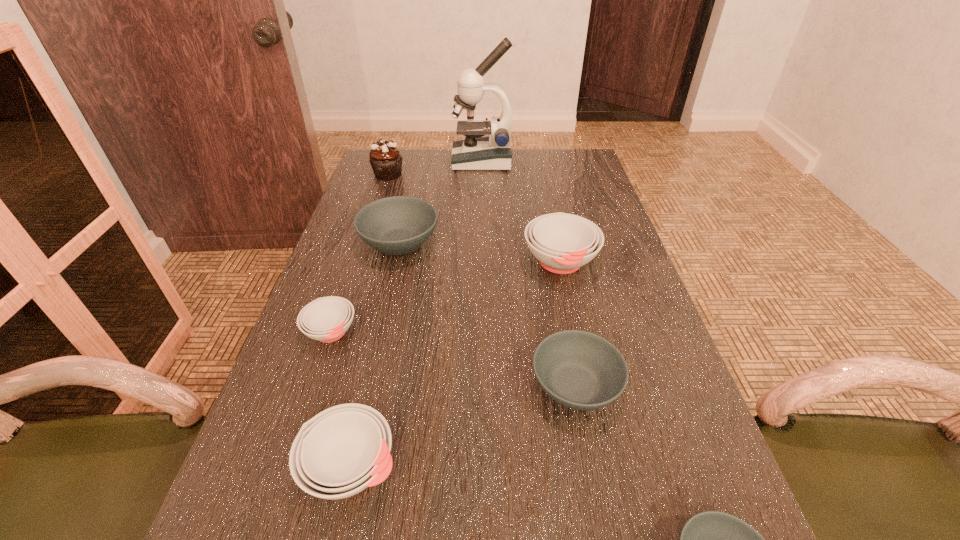
Locate an element on the screen. The width and height of the screenshot is (960, 540). microscope is located at coordinates (476, 152).

Find the location of a particular element. cupcake is located at coordinates (386, 161).

Locate an element on the screen. brown cupcake is located at coordinates (386, 161).

The image size is (960, 540). What are the coordinates of `the biggest white soup bowl` in the screenshot? It's located at (562, 242).

You are a GUI agent. You are given a task and a screenshot of the screen. Output one action in this format:
    pyautogui.click(x=<x>, y=<y>)
    Task: Click on the farthest white soup bowl
    
    Given the screenshot: What is the action you would take?
    pyautogui.click(x=562, y=242)

You are a GUI agent. You are given a task and a screenshot of the screen. Output one action in this format:
    pyautogui.click(x=<x>, y=<y>)
    Task: Click on the farthest gray soup bowl
    
    Given the screenshot: What is the action you would take?
    pyautogui.click(x=398, y=225)

Locate an element on the screen. The width and height of the screenshot is (960, 540). the biggest gray soup bowl is located at coordinates (398, 225).

Where is `the nearest white soup bowl`? The width and height of the screenshot is (960, 540). the nearest white soup bowl is located at coordinates (341, 451).

Locate an element on the screen. Image resolution: width=960 pixels, height=540 pixels. the second biggest gray soup bowl is located at coordinates (580, 370).

Identify the location of the smallest white soup bowl. (326, 319).